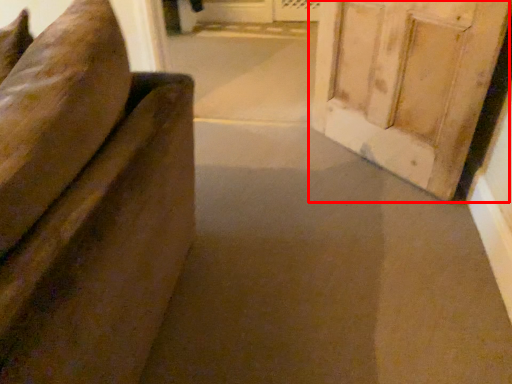
Question: Where is door (annotated by the red box) located in relation to passage in the image?

Choices:
 (A) right
 (B) left

Answer: (A)